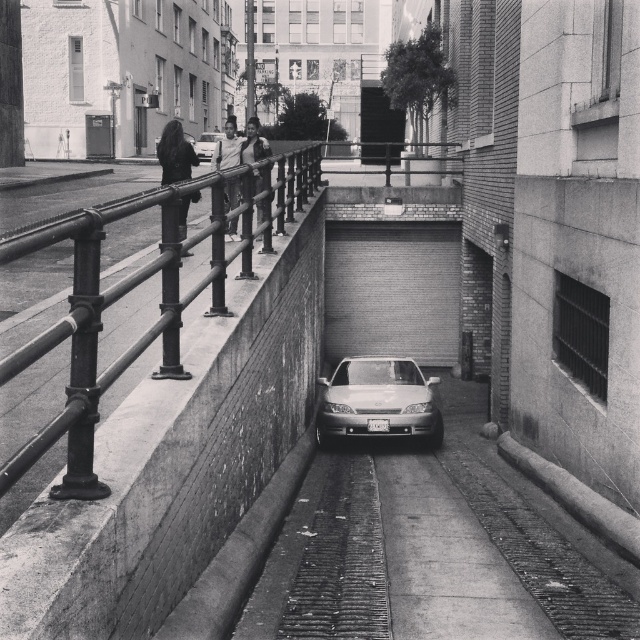
Which is more to the left, black metal railing at upper left or silver metallic sedan at center?

From the viewer's perspective, black metal railing at upper left appears more on the left side.

Can you confirm if black metal railing at upper left is positioned to the right of silver metallic sedan at center?

Incorrect, black metal railing at upper left is not on the right side of silver metallic sedan at center.

Where is `black metal railing at upper left`? Image resolution: width=640 pixels, height=640 pixels. black metal railing at upper left is located at coordinates (157, 305).

Between silver metallic sedan at center and shiny silver sedan at center, which one is positioned lower?

silver metallic sedan at center is below.

Is silver metallic sedan at center shorter than shiny silver sedan at center?

Correct, silver metallic sedan at center is not as tall as shiny silver sedan at center.

At what (x,y) coordinates should I click in order to perform the action: click on silver metallic sedan at center. Please return your answer as a coordinate pair (x, y). The width and height of the screenshot is (640, 640). Looking at the image, I should click on (378, 401).

From the picture: Is black metal railing at upper left closer to camera compared to shiny silver sedan at center?

Yes.

Who is more forward, (54, 428) or (209, 134)?

Positioned in front is point (54, 428).

Does point (291, 163) come behind point (211, 141)?

No, it is in front of (211, 141).

You are a GUI agent. You are given a task and a screenshot of the screen. Output one action in this format:
    pyautogui.click(x=<x>, y=<y>)
    Task: Click on the black metal railing at upper left
    This screenshot has height=640, width=640.
    Given the screenshot: What is the action you would take?
    pyautogui.click(x=157, y=305)